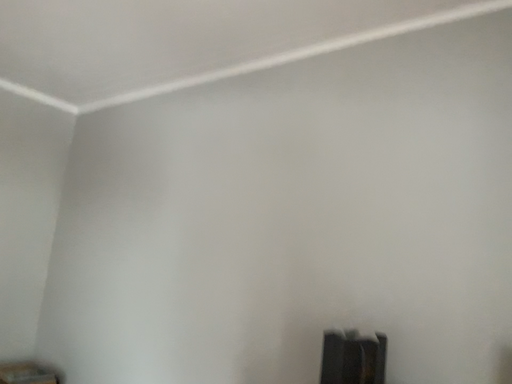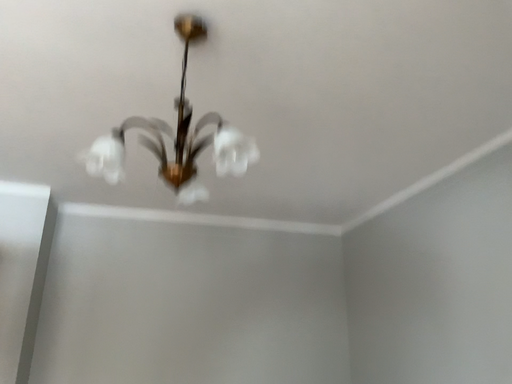
Question: Which way did the camera rotate in the video?

Choices:
 (A) rotated left
 (B) rotated right

Answer: (A)